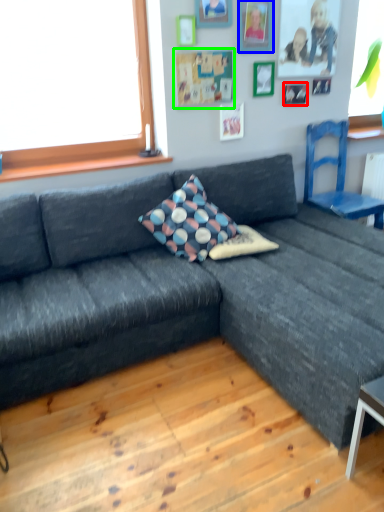
Question: Estimate the real-world distances between objects in this image. Which object is farther from picture frame (highlighted by a red box), picture frame (highlighted by a blue box) or bulletin board (highlighted by a green box)?

Choices:
 (A) picture frame
 (B) bulletin board

Answer: (B)